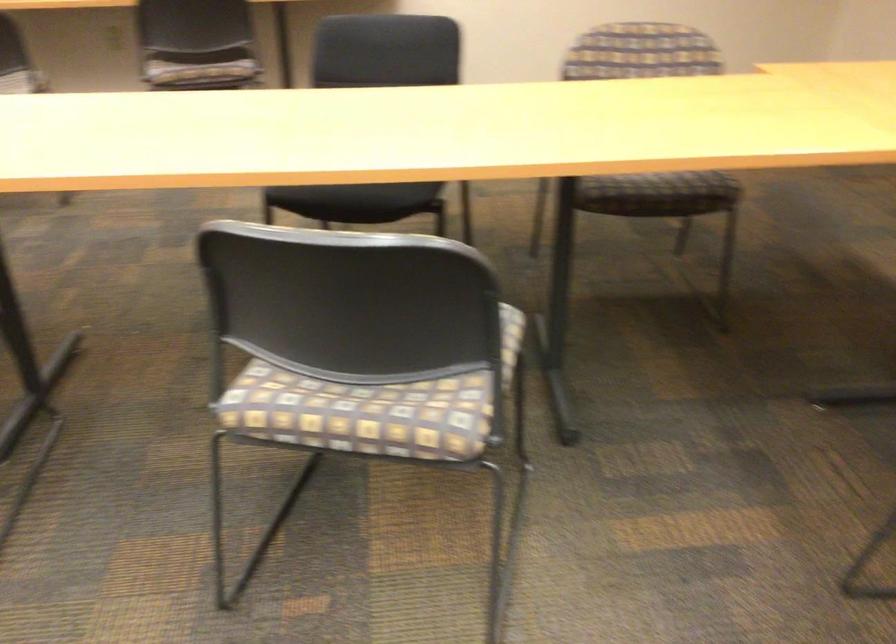
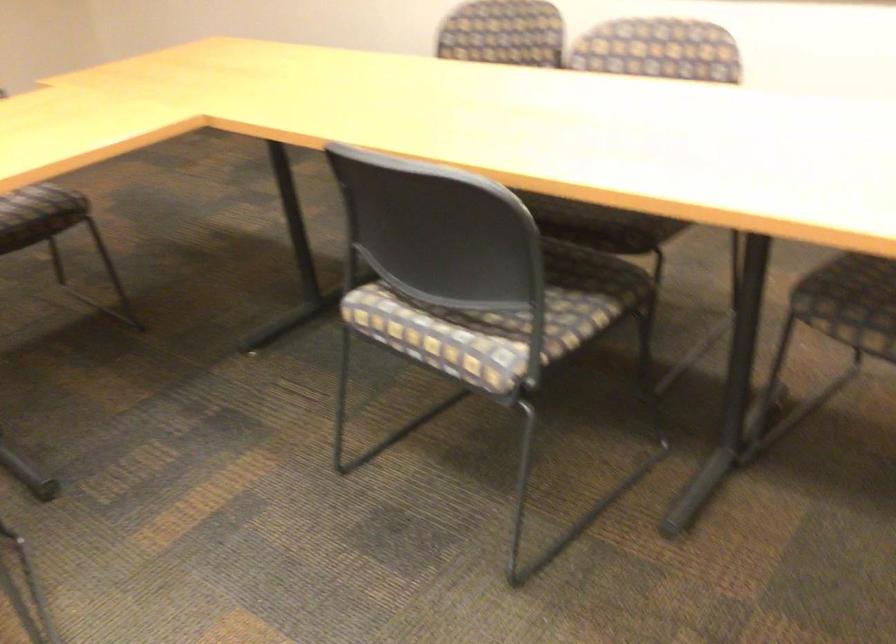
Question: The first image is from the beginning of the video and the second image is from the end. How did the camera likely rotate when shooting the video?

Choices:
 (A) Left
 (B) Right
 (C) Up
 (D) Down

Answer: (B)